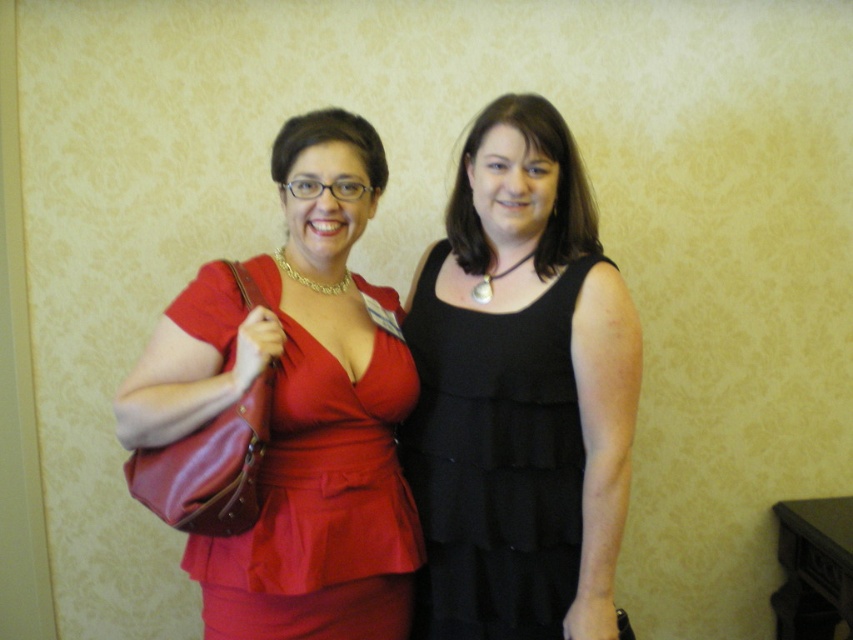
Between black matte dress at center and matte red dress at left, which one has less height?

matte red dress at left

In the scene shown: Does black matte dress at center appear on the left side of matte red dress at left?

In fact, black matte dress at center is to the right of matte red dress at left.

Where is `black matte dress at center`? The width and height of the screenshot is (853, 640). black matte dress at center is located at coordinates (494, 460).